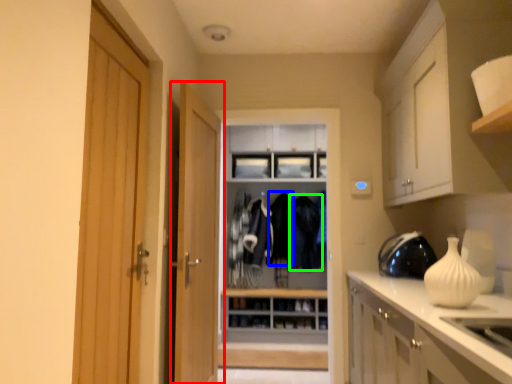
Question: Which object is positioned closest to door (highlighted by a red box)? Select from clothing (highlighted by a blue box) and clothing (highlighted by a green box).

Choices:
 (A) clothing
 (B) clothing

Answer: (A)